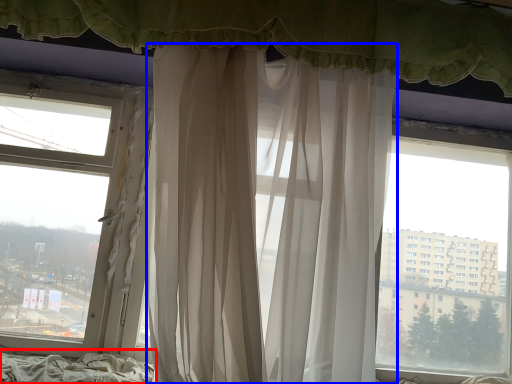
Question: Which point is closer to the camera, bed frame (highlighted by a red box) or curtain (highlighted by a blue box)?

Choices:
 (A) bed frame
 (B) curtain

Answer: (B)